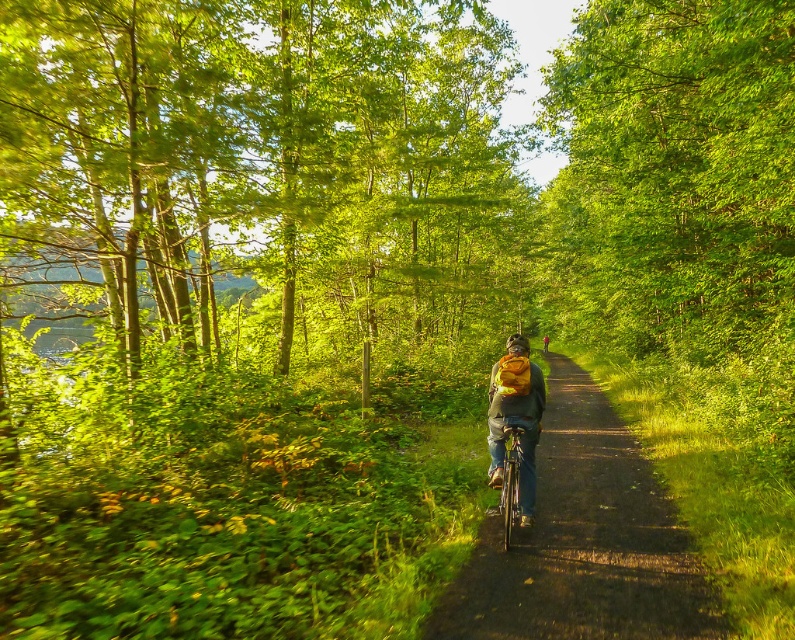
You are standing at the position of the viewer in the scene. The cyclist wants to ride their bike straight towards the green leafy tree at center. Is the distance between you and the tree sufficient for the cyclist to safely stop before reaching it if they start braking from your current position? Assume the cyclist is traveling at 10 mph and can decelerate at 0.5g.

The distance between the green leafy tree at center and the viewer is 21.15 feet. To determine if the cyclist can stop safely, we calculate the braking distance using the formula d_v2_u2_over_2a. Converting 10 mph to feet per second gives approximately 14.667 ft per second. Plugging into the formula, the required stopping distance is around 21.65 feet. Since the available distance is 21.15 feet, which is slightly less than needed, the cyclist cannot safely stop before reaching the tree.

You are a cyclist planning to ride along the smooth asphalt path at center. There is a shiny metallic bicycle at center in your way. Can you safely pass around it without leaving the path?

The smooth asphalt path at center is in front of the shiny metallic bicycle at center, meaning the bicycle is blocking your path. Since the path is narrow and the bicycle is directly in front, you cannot safely pass around it without leaving the path.

You are a cyclist planning to ride through the forest path. You see the smooth asphalt path at center and the shiny metallic bicycle at center in the image. Which object is positioned lower in the scene?

The smooth asphalt path at center is located below the shiny metallic bicycle at center, so it is positioned lower in the scene.